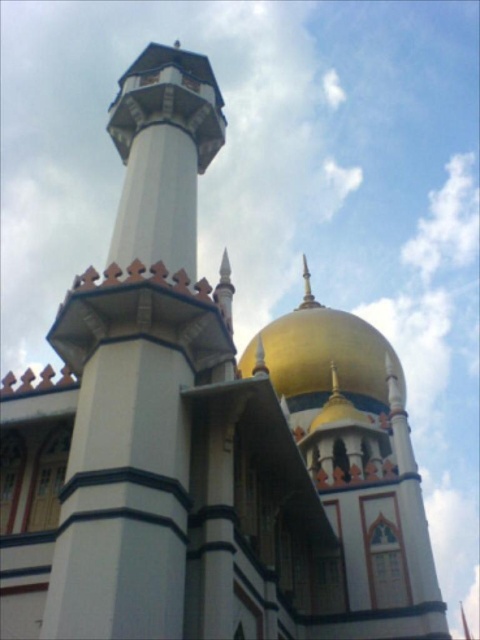
You are standing in front of the mosque and notice two points marked on the facade. The first point is at coordinates point (342, 410) and the second is at point (149, 211). From your perspective, which point is closer to you?

Point (149, 211) is closer to you because it is in front of point (342, 410).

You are an architect evaluating the mosque design. You need to determine if the gold shiny dome at upper center can be seen from the entrance without obstruction by the white stone minaret at upper left. Based on their positions and sizes, what is your assessment?

The gold shiny dome at upper center might be wider than the white stone minaret at upper left, so there could be a possibility that the dome is wider and thus may block the view of the minaret or vice versa. However, without exact measurements of their heights and angles, it is difficult to definitively conclude visibility.